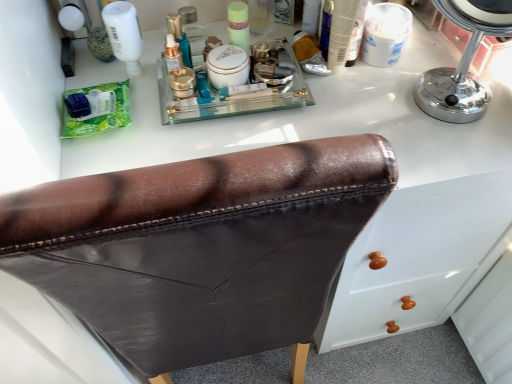
Where is `vacant area located to the right-hand side of green matte packet at left`? The height and width of the screenshot is (384, 512). vacant area located to the right-hand side of green matte packet at left is located at coordinates (179, 121).